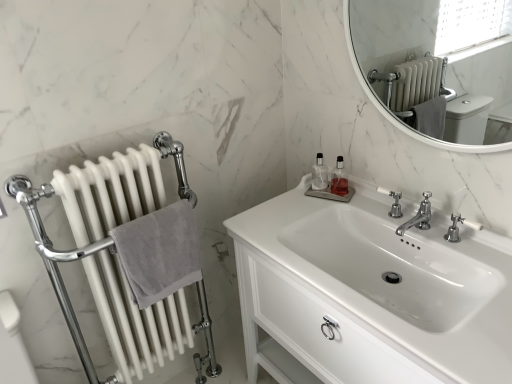
This screenshot has height=384, width=512. Identify the location of free space in front of polished chrome faucet at center, the 2th tap when ordered from right to left. (456, 256).